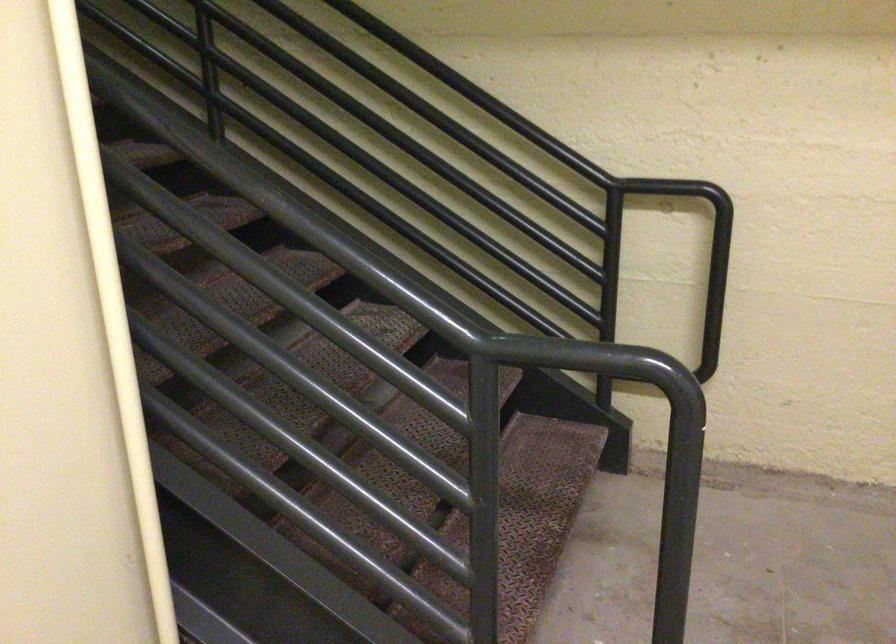
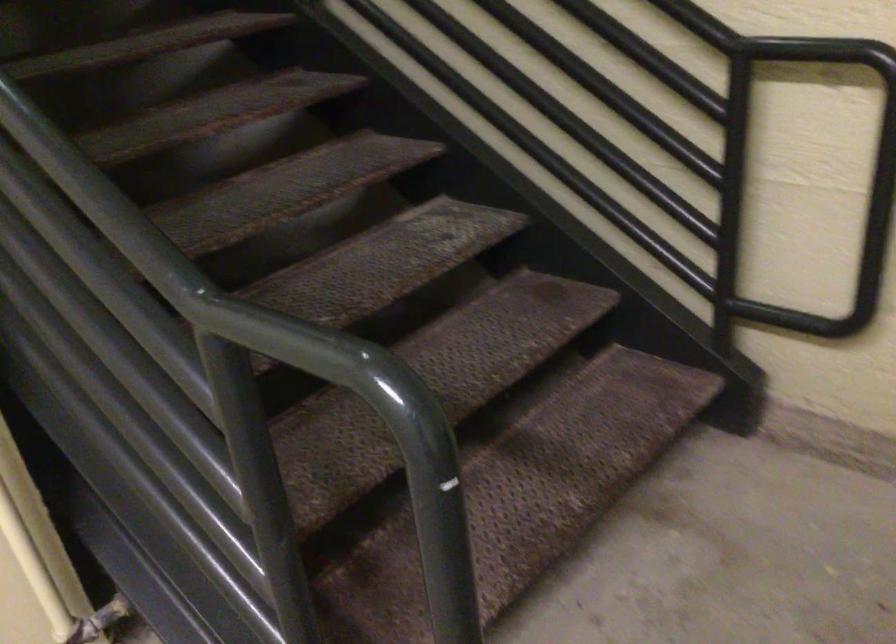
Question: How did the camera likely rotate?

Choices:
 (A) Left
 (B) Right
 (C) Up
 (D) Down

Answer: (A)